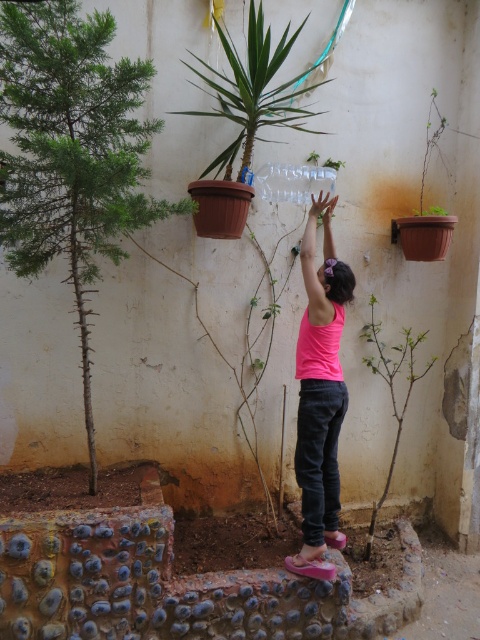
You are standing in the garden and want to locate the green spiky tree at lower left. What are the coordinates where you should look?

The green spiky tree at lower left is located at coordinates point (72, 152).

You are standing in the garden and want to locate the point at coordinates (x=72, y=152). According to the scene description, which object is this point located on?

The point at coordinates (x=72, y=152) is located on the green spiky tree at lower left.